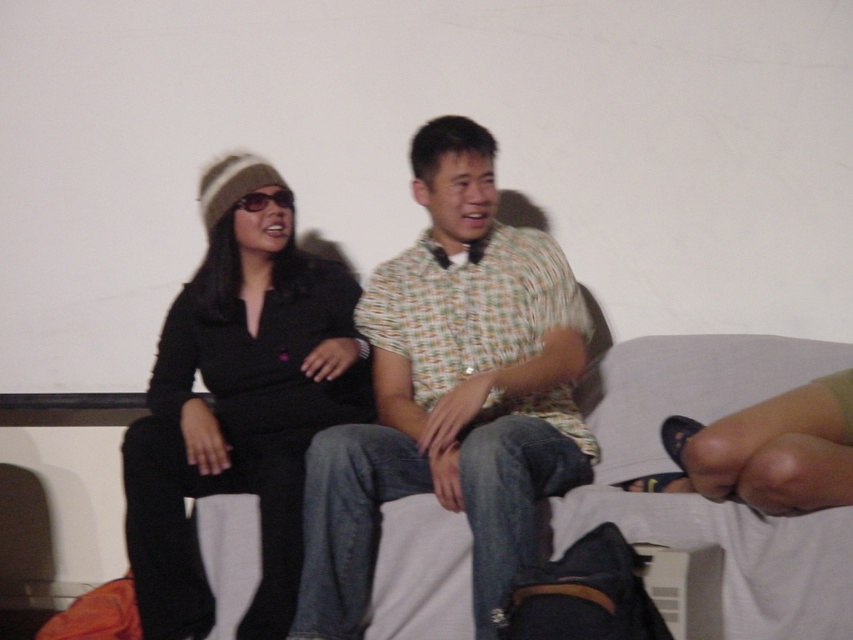
Question: Which point is farther from the camera taking this photo?

Choices:
 (A) (474, 444)
 (B) (225, 323)

Answer: (B)

Question: Which of the following is the closest to the observer?

Choices:
 (A) checkered fabric shirt at center
 (B) black matte shirt at left

Answer: (A)

Question: Can you confirm if checkered fabric shirt at center is wider than black matte shirt at left?

Choices:
 (A) no
 (B) yes

Answer: (B)

Question: Can you confirm if checkered fabric shirt at center is bigger than black matte shirt at left?

Choices:
 (A) yes
 (B) no

Answer: (A)

Question: Observing the image, what is the correct spatial positioning of checkered fabric shirt at center in reference to black matte shirt at left?

Choices:
 (A) right
 (B) left

Answer: (A)